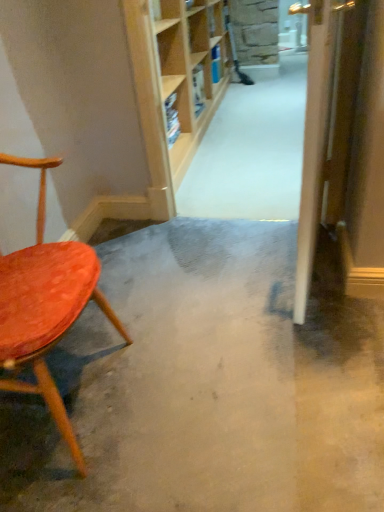
Question: Is wooden door at right wider or thinner than smooth concrete floor at center?

Choices:
 (A) thin
 (B) wide

Answer: (A)

Question: Is wooden door at right spatially inside smooth concrete floor at center, or outside of it?

Choices:
 (A) outside
 (B) inside

Answer: (A)

Question: Which of these objects is positioned closest to the wooden door at right?

Choices:
 (A) velvet orange chair at left
 (B) smooth concrete floor at center
 (C) wooden bookshelf at upper center

Answer: (B)

Question: Which is farther from the velvet orange chair at left?

Choices:
 (A) wooden door at right
 (B) smooth concrete floor at center
 (C) wooden bookshelf at upper center

Answer: (C)